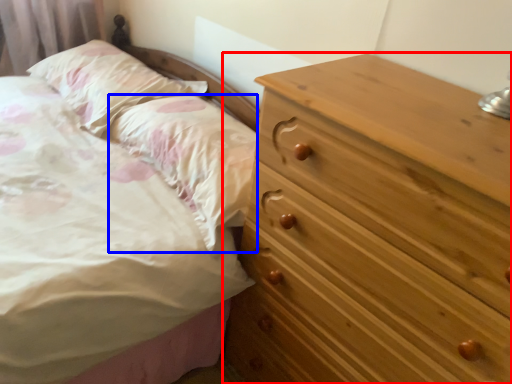
Question: Which object appears closest to the camera in this image, chest of drawers (highlighted by a red box) or pillow (highlighted by a blue box)?

Choices:
 (A) chest of drawers
 (B) pillow

Answer: (A)